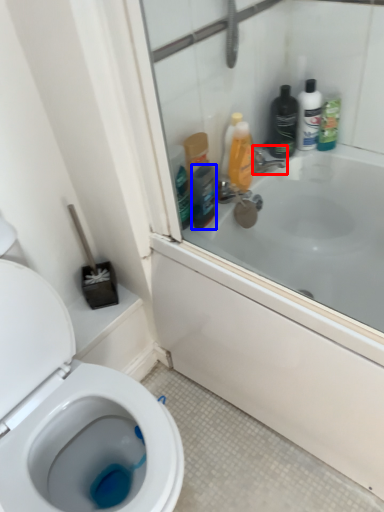
Question: Among these objects, which one is farthest to the camera, tap (highlighted by a red box) or mouthwash (highlighted by a blue box)?

Choices:
 (A) tap
 (B) mouthwash

Answer: (A)